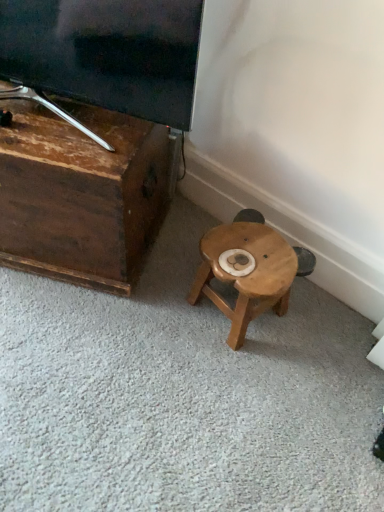
At what (x,y) coordinates should I click in order to perform the action: click on dark brown wood tv stand at left. Please return your answer as a coordinate pair (x, y). This screenshot has height=512, width=384. Looking at the image, I should click on (82, 193).

Describe the element at coordinates (82, 193) in the screenshot. I see `dark brown wood tv stand at left` at that location.

Measure the distance between point [114,217] and camera.

They are 3.49 feet apart.

What is the approximate width of dark brown wood tv stand at left?

21.63 inches.

What is the approximate height of wooden stool at center?

9.66 inches.

Image resolution: width=384 pixels, height=512 pixels. What are the coordinates of `wooden stool at center` in the screenshot? It's located at (246, 273).

Image resolution: width=384 pixels, height=512 pixels. What do you see at coordinates (246, 273) in the screenshot? I see `wooden stool at center` at bounding box center [246, 273].

The height and width of the screenshot is (512, 384). Find the location of `dark brown wood tv stand at left`. dark brown wood tv stand at left is located at coordinates [x=82, y=193].

Is wooden stool at center at the left side of dark brown wood tv stand at left?

Incorrect, wooden stool at center is not on the left side of dark brown wood tv stand at left.

Considering the positions of objects wooden stool at center and dark brown wood tv stand at left in the image provided, who is in front, wooden stool at center or dark brown wood tv stand at left?

Positioned in front is dark brown wood tv stand at left.

Which is closer to the camera, (250, 290) or (97, 125)?

Point (250, 290)

In the scene shown: From the image's perspective, would you say wooden stool at center is shown under dark brown wood tv stand at left?

Correct, wooden stool at center appears lower than dark brown wood tv stand at left in the image.

From a real-world perspective, between wooden stool at center and dark brown wood tv stand at left, who is vertically higher?

dark brown wood tv stand at left, from a real-world perspective.

Which of these two, wooden stool at center or dark brown wood tv stand at left, is thinner?

wooden stool at center.

In terms of height, does wooden stool at center look taller or shorter compared to dark brown wood tv stand at left?

In the image, wooden stool at center appears to be shorter than dark brown wood tv stand at left.

Considering the sizes of objects wooden stool at center and dark brown wood tv stand at left in the image provided, who is smaller, wooden stool at center or dark brown wood tv stand at left?

Smaller between the two is wooden stool at center.

Would you say wooden stool at center is inside or outside dark brown wood tv stand at left?

wooden stool at center is not enclosed by dark brown wood tv stand at left.

Is there a large distance between wooden stool at center and dark brown wood tv stand at left?

No, there isn't a large distance between wooden stool at center and dark brown wood tv stand at left.

Could you tell me if wooden stool at center is facing dark brown wood tv stand at left?

No, wooden stool at center is not facing towards dark brown wood tv stand at left.

In order to click on stool on the right of dark brown wood tv stand at left in this screenshot , I will do `click(246, 273)`.

Is dark brown wood tv stand at left at the right side of wooden stool at center?

In fact, dark brown wood tv stand at left is to the left of wooden stool at center.

Between dark brown wood tv stand at left and wooden stool at center, which one is positioned behind?

wooden stool at center is behind.

Considering the points (158, 225) and (273, 298), which point is in front, point (158, 225) or point (273, 298)?

The point (273, 298) is in front.

From the image's perspective, does dark brown wood tv stand at left appear lower than wooden stool at center?

Incorrect, from the image's perspective, dark brown wood tv stand at left is higher than wooden stool at center.

Consider the image. From a real-world perspective, is dark brown wood tv stand at left beneath wooden stool at center?

Actually, dark brown wood tv stand at left is physically above wooden stool at center in the real world.

Looking at their sizes, would you say dark brown wood tv stand at left is wider or thinner than wooden stool at center?

Considering their sizes, dark brown wood tv stand at left looks broader than wooden stool at center.

Looking at this image, considering the relative sizes of dark brown wood tv stand at left and wooden stool at center in the image provided, is dark brown wood tv stand at left taller than wooden stool at center?

Correct, dark brown wood tv stand at left is much taller as wooden stool at center.

Is dark brown wood tv stand at left smaller than wooden stool at center?

Actually, dark brown wood tv stand at left might be larger than wooden stool at center.

Is dark brown wood tv stand at left completely or partially outside of wooden stool at center?

That's correct, dark brown wood tv stand at left is outside of wooden stool at center.

Would you say dark brown wood tv stand at left is a long distance from wooden stool at center?

That's not correct — dark brown wood tv stand at left is a little close to wooden stool at center.

Is dark brown wood tv stand at left oriented towards wooden stool at center?

No.

How different are the orientations of dark brown wood tv stand at left and wooden stool at center in degrees?

The facing directions of dark brown wood tv stand at left and wooden stool at center are 32.8 degrees apart.

The image size is (384, 512). In order to click on stool that is behind the dark brown wood tv stand at left in this screenshot , I will do `click(246, 273)`.

Locate an element on the screen. This screenshot has width=384, height=512. furniture that appears above the wooden stool at center (from a real-world perspective) is located at coordinates (82, 193).

I want to click on furniture in front of the wooden stool at center, so click(x=82, y=193).